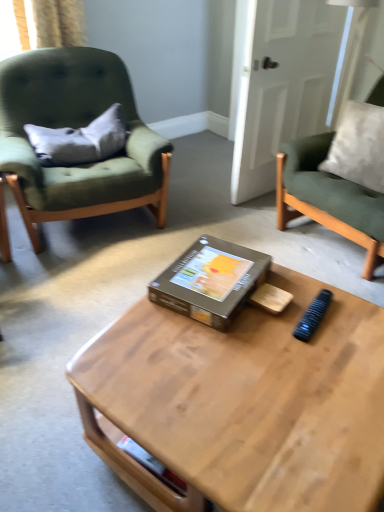
Find the location of a particular element. This screenshot has width=384, height=512. gray fabric pillow at left is located at coordinates (80, 140).

Describe the element at coordinates (243, 403) in the screenshot. This screenshot has width=384, height=512. I see `wooden coffee table at center` at that location.

Locate an element on the screen. brown cardboard box at center is located at coordinates (210, 281).

Where is `velvet green chair at right, positioned as the 2th chair in left-to-right order`? The image size is (384, 512). velvet green chair at right, positioned as the 2th chair in left-to-right order is located at coordinates (329, 198).

From the image's perspective, is gray fabric pillow at left above or below brown cardboard box at center?

From the image's perspective, gray fabric pillow at left appears above brown cardboard box at center.

From a real-world perspective, is gray fabric pillow at left physically located above or below brown cardboard box at center?

In terms of real-world spatial position, gray fabric pillow at left is above brown cardboard box at center.

Which object is wider, gray fabric pillow at left or brown cardboard box at center?

brown cardboard box at center is wider.

Is gray fabric pillow at left outside of brown cardboard box at center?

Indeed, gray fabric pillow at left is completely outside brown cardboard box at center.

From a real-world perspective, is black plastic remote control at center under gray fabric pillow at left?

Indeed, from a real-world perspective, black plastic remote control at center is positioned beneath gray fabric pillow at left.

From the image's perspective, is black plastic remote control at center beneath gray fabric pillow at left?

Yes, from the image's perspective, black plastic remote control at center is beneath gray fabric pillow at left.

Considering the positions of objects black plastic remote control at center and gray fabric pillow at left in the image provided, who is more to the right, black plastic remote control at center or gray fabric pillow at left?

black plastic remote control at center.

Looking at their sizes, would you say black plastic remote control at center is wider or thinner than velvet green chair at right, positioned as the 2th chair in left-to-right order?

Considering their sizes, black plastic remote control at center looks slimmer than velvet green chair at right, positioned as the 2th chair in left-to-right order.

Is point (309, 325) positioned in front of point (383, 86)?

Yes, it is.

From a real-world perspective, relative to velvet green chair at right, which appears as the 1th chair when viewed from the right, is black plastic remote control at center vertically above or below?

Clearly, from a real-world perspective, black plastic remote control at center is below velvet green chair at right, which appears as the 1th chair when viewed from the right.

Are black plastic remote control at center and velvet green chair at right, positioned as the 2th chair in left-to-right order, located far from each other?

That's not correct — black plastic remote control at center is a little close to velvet green chair at right, positioned as the 2th chair in left-to-right order.

Are gray fabric pillow at left and green fabric chair at left, arranged as the 1th chair when viewed from the left, located far from each other?

No.

From a real-world perspective, is gray fabric pillow at left under green fabric chair at left, arranged as the 1th chair when viewed from the left?

No, from a real-world perspective, gray fabric pillow at left is not beneath green fabric chair at left, arranged as the 1th chair when viewed from the left.

Can you confirm if gray fabric pillow at left is thinner than green fabric chair at left, arranged as the 1th chair when viewed from the left?

Yes.

Looking at this image, is green fabric chair at left, the second chair from the right, surrounded by gray fabric pillow at left?

No, gray fabric pillow at left does not contain green fabric chair at left, the second chair from the right.

Considering the points (302, 338) and (85, 215), which point is behind, point (302, 338) or point (85, 215)?

Point (85, 215)

Considering the positions of objects black plastic remote control at center and green fabric chair at left, arranged as the 1th chair when viewed from the left, in the image provided, who is more to the left, black plastic remote control at center or green fabric chair at left, arranged as the 1th chair when viewed from the left,?

Positioned to the left is green fabric chair at left, arranged as the 1th chair when viewed from the left.

Is black plastic remote control at center positioned before green fabric chair at left, the second chair from the right?

Yes, the depth of black plastic remote control at center is less than that of green fabric chair at left, the second chair from the right.

Considering the relative sizes of black plastic remote control at center and green fabric chair at left, arranged as the 1th chair when viewed from the left, in the image provided, is black plastic remote control at center smaller than green fabric chair at left, arranged as the 1th chair when viewed from the left,?

Indeed, black plastic remote control at center has a smaller size compared to green fabric chair at left, arranged as the 1th chair when viewed from the left.

Measure the distance from wooden coffee table at center to gray fabric pillow at left.

wooden coffee table at center and gray fabric pillow at left are 4.99 feet apart from each other.

Can you tell me how much wooden coffee table at center and gray fabric pillow at left differ in facing direction?

The angle between the facing direction of wooden coffee table at center and the facing direction of gray fabric pillow at left is 150 degrees.

Consider the image. Does wooden coffee table at center contain gray fabric pillow at left?

Definitely not — gray fabric pillow at left is not inside wooden coffee table at center.

Does wooden coffee table at center have a smaller size compared to gray fabric pillow at left?

Incorrect, wooden coffee table at center is not smaller in size than gray fabric pillow at left.

Considering the relative sizes of green fabric chair at left, arranged as the 1th chair when viewed from the left, and velvet green chair at right, positioned as the 2th chair in left-to-right order, in the image provided, is green fabric chair at left, arranged as the 1th chair when viewed from the left, wider than velvet green chair at right, positioned as the 2th chair in left-to-right order,?

Indeed, green fabric chair at left, arranged as the 1th chair when viewed from the left, has a greater width compared to velvet green chair at right, positioned as the 2th chair in left-to-right order.

Is green fabric chair at left, the second chair from the right, to the left of velvet green chair at right, positioned as the 2th chair in left-to-right order, from the viewer's perspective?

Yes.

From a real-world perspective, does green fabric chair at left, arranged as the 1th chair when viewed from the left, stand above velvet green chair at right, which appears as the 1th chair when viewed from the right?

Actually, green fabric chair at left, arranged as the 1th chair when viewed from the left, is physically below velvet green chair at right, which appears as the 1th chair when viewed from the right, in the real world.

From the image's perspective, which one is positioned higher, green fabric chair at left, the second chair from the right, or velvet green chair at right, which appears as the 1th chair when viewed from the right?

green fabric chair at left, the second chair from the right.

I want to click on pillow above the brown cardboard box at center (from a real-world perspective), so click(80, 140).

Where is `pillow lying above the black plastic remote control at center (from the image's perspective)`? Image resolution: width=384 pixels, height=512 pixels. pillow lying above the black plastic remote control at center (from the image's perspective) is located at coordinates (80, 140).

Estimate the real-world distances between objects in this image. Which object is further from gray fabric pillow at left, black plastic remote control at center or green fabric chair at left, the second chair from the right?

black plastic remote control at center.

Considering their positions, is gray fabric pillow at left positioned closer to black plastic remote control at center than velvet green chair at right, positioned as the 2th chair in left-to-right order?

velvet green chair at right, positioned as the 2th chair in left-to-right order, lies closer to black plastic remote control at center than the other object.

Which object lies nearer to the anchor point green fabric chair at left, the second chair from the right, gray fabric pillow at left or velvet green chair at right, positioned as the 2th chair in left-to-right order?

gray fabric pillow at left is closer to green fabric chair at left, the second chair from the right.

From the image, which object appears to be farther from velvet green chair at right, positioned as the 2th chair in left-to-right order, green fabric chair at left, the second chair from the right, or gray fabric pillow at left?

gray fabric pillow at left.

Based on their spatial positions, is black plastic remote control at center or gray fabric pillow at left closer to velvet green chair at right, positioned as the 2th chair in left-to-right order?

black plastic remote control at center.

When comparing their distances from black plastic remote control at center, does gray fabric pillow at left or wooden coffee table at center seem further?

gray fabric pillow at left.

Based on the photo, looking at the image, which one is located closer to wooden coffee table at center, green fabric chair at left, the second chair from the right, or brown cardboard box at center?

brown cardboard box at center is closer to wooden coffee table at center.

Estimate the real-world distances between objects in this image. Which object is closer to wooden coffee table at center, gray fabric pillow at left or brown cardboard box at center?

brown cardboard box at center lies closer to wooden coffee table at center than the other object.

You are a GUI agent. You are given a task and a screenshot of the screen. Output one action in this format:
    pyautogui.click(x=<x>, y=<y>)
    Task: Click on the box between green fabric chair at left, the second chair from the right, and black plastic remote control at center
    The height and width of the screenshot is (512, 384).
    Given the screenshot: What is the action you would take?
    pyautogui.click(x=210, y=281)

The width and height of the screenshot is (384, 512). In order to click on box between gray fabric pillow at left and velvet green chair at right, which appears as the 1th chair when viewed from the right in this screenshot , I will do `click(210, 281)`.

Locate an element on the screen. remote control between green fabric chair at left, the second chair from the right, and wooden coffee table at center in the up-down direction is located at coordinates (312, 316).

The image size is (384, 512). I want to click on box that lies between velvet green chair at right, which appears as the 1th chair when viewed from the right, and wooden coffee table at center from top to bottom, so click(x=210, y=281).